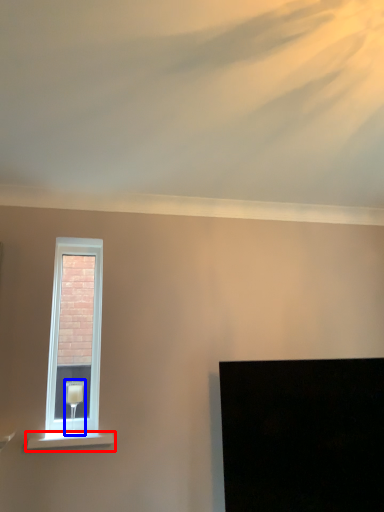
Question: Among these objects, which one is farthest to the camera, window sill (highlighted by a red box) or table lamp (highlighted by a blue box)?

Choices:
 (A) window sill
 (B) table lamp

Answer: (B)